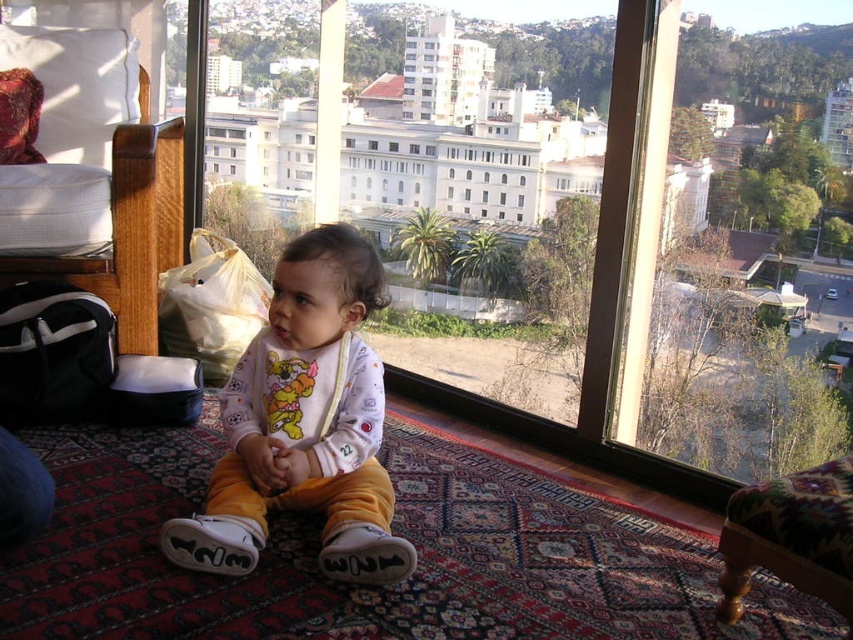
You are a parent trying to locate your child who is playing with a bib. You see the transparent glass door at center and the white cotton bib at center. Which object is closer to the right side of the room?

The transparent glass door at center is positioned on the right side of the white cotton bib at center, so it is closer to the right side of the room.

You are a delivery person carrying a large package that is 1.2 meters wide. You need to deliver it through the transparent glass door at center and then place it next to the wooden armchair at lower right. Can the package fit through the door?

The transparent glass door at center is wider than the wooden armchair at lower right. Since the package is 1.2 meters wide, it can fit through the door as long as the door width is greater than 1.2 meters. However, the exact width of the door isn